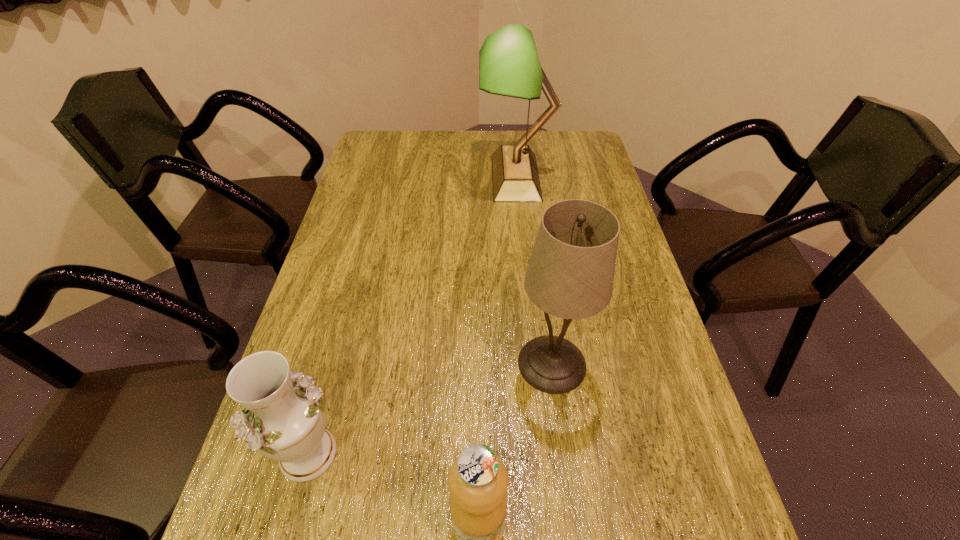
Identify the location of table lamp. This screenshot has height=540, width=960. (509, 65).

This screenshot has height=540, width=960. What are the coordinates of `lampshade` in the screenshot? It's located at (570, 275).

What are the coordinates of `the second nearest object` in the screenshot? It's located at (284, 419).

At what (x,y) coordinates should I click in order to perform the action: click on the leftmost object. Please return your answer as a coordinate pair (x, y). The image size is (960, 540). Looking at the image, I should click on (284, 419).

You are a GUI agent. You are given a task and a screenshot of the screen. Output one action in this format:
    pyautogui.click(x=<x>, y=<y>)
    Task: Click on the blank space located 0.150m on the metallic stand of the farthest object
    Image resolution: width=960 pixels, height=540 pixels.
    Given the screenshot: What is the action you would take?
    pyautogui.click(x=436, y=178)

Where is `vacant space located 0.390m on the metallic stand of the farthest object`? The image size is (960, 540). vacant space located 0.390m on the metallic stand of the farthest object is located at coordinates (367, 178).

Find the location of a particular element. The image size is (960, 540). vacant space situated on the metallic stand of the farthest object is located at coordinates (421, 178).

The height and width of the screenshot is (540, 960). I want to click on vacant point located 0.350m on the front-facing side of the third nearest object, so click(x=362, y=363).

You are a GUI agent. You are given a task and a screenshot of the screen. Output one action in this format:
    pyautogui.click(x=<x>, y=<y>)
    Task: Click on the free space located 0.220m on the front-facing side of the third nearest object
    The image size is (960, 540).
    Given the screenshot: What is the action you would take?
    pyautogui.click(x=420, y=363)

The image size is (960, 540). Find the location of `vacant space located 0.240m on the front-facing side of the third nearest object`. vacant space located 0.240m on the front-facing side of the third nearest object is located at coordinates (410, 363).